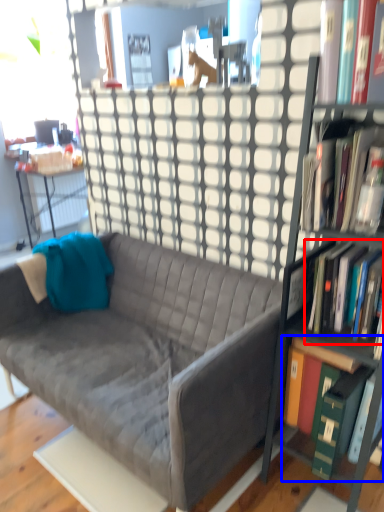
Question: Which point is closer to the camera, book (highlighted by a red box) or book (highlighted by a blue box)?

Choices:
 (A) book
 (B) book

Answer: (A)